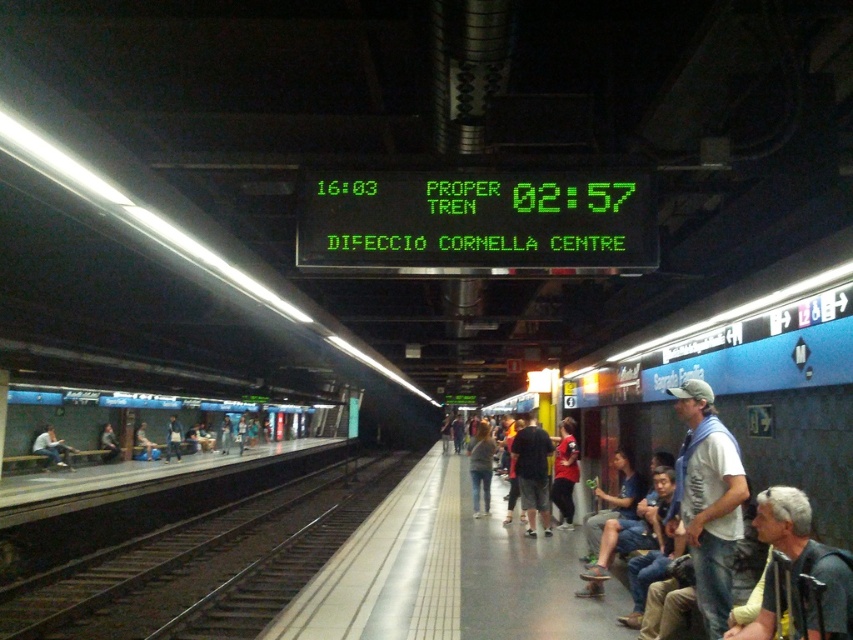
Consider the image. You are a passenger standing on the subway platform. You notice the black metal train track at lower left and the light blue jeans at platform left. Which object is higher in elevation?

The black metal train track at lower left is higher in elevation compared to the light blue jeans at platform left.

You are a visually impaired person using a white cane to navigate the subway platform. You feel the yellow tactile paving strip under your feet and want to sit down on the nearest available bench. Which object should you move towards, the black metal train track at lower left or the blue glossy bench at left?

You should move towards the blue glossy bench at left because the black metal train track at lower left is closer to the viewer but the bench is the appropriate place to sit. However, according to the Objects Description, the black metal train track at lower left is closer to the viewer than the blue glossy bench at left, meaning the bench is farther away. Since you want the nearest bench, you should first check if there are any closer benches not listed here. If only these two options exist, despite theben